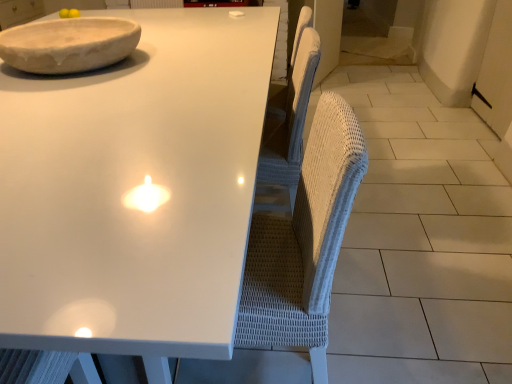
Question: From a real-world perspective, is white wicker swivel chair at center below white marble bowl at upper left?

Choices:
 (A) no
 (B) yes

Answer: (B)

Question: Is white wicker swivel chair at center touching white marble bowl at upper left?

Choices:
 (A) yes
 (B) no

Answer: (B)

Question: Does white wicker swivel chair at center appear on the right side of white marble bowl at upper left?

Choices:
 (A) yes
 (B) no

Answer: (A)

Question: From a real-world perspective, is white wicker swivel chair at center located higher than white marble bowl at upper left?

Choices:
 (A) no
 (B) yes

Answer: (A)

Question: Considering the relative sizes of white wicker swivel chair at center and white marble bowl at upper left in the image provided, is white wicker swivel chair at center wider than white marble bowl at upper left?

Choices:
 (A) no
 (B) yes

Answer: (A)

Question: Considering the positions of white wicker swivel chair at center and white marble bowl at upper left in the image, is white wicker swivel chair at center taller or shorter than white marble bowl at upper left?

Choices:
 (A) tall
 (B) short

Answer: (A)

Question: Is white wicker swivel chair at center spatially inside white marble bowl at upper left, or outside of it?

Choices:
 (A) outside
 (B) inside

Answer: (A)

Question: From the image's perspective, is white wicker swivel chair at center located above or below white marble bowl at upper left?

Choices:
 (A) below
 (B) above

Answer: (A)

Question: From a real-world perspective, is white wicker swivel chair at center above or below white marble bowl at upper left?

Choices:
 (A) below
 (B) above

Answer: (A)

Question: Looking at the image, does white glossy table at upper center seem bigger or smaller compared to white marble bowl at upper left?

Choices:
 (A) big
 (B) small

Answer: (A)

Question: From a real-world perspective, is white glossy table at upper center positioned above or below white marble bowl at upper left?

Choices:
 (A) below
 (B) above

Answer: (A)

Question: Is white glossy table at upper center in front of or behind white marble bowl at upper left in the image?

Choices:
 (A) behind
 (B) front

Answer: (B)

Question: Is point (54, 249) positioned closer to the camera than point (120, 36)?

Choices:
 (A) farther
 (B) closer

Answer: (B)

Question: Is white glossy table at upper center wider or thinner than white wicker swivel chair at center?

Choices:
 (A) thin
 (B) wide

Answer: (B)

Question: From the image's perspective, is white glossy table at upper center above or below white wicker swivel chair at center?

Choices:
 (A) above
 (B) below

Answer: (A)